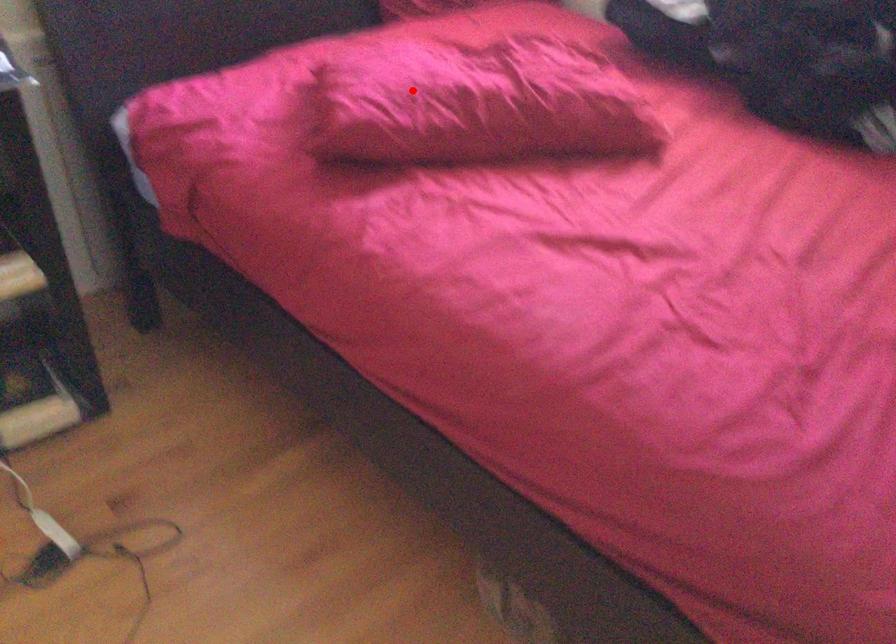
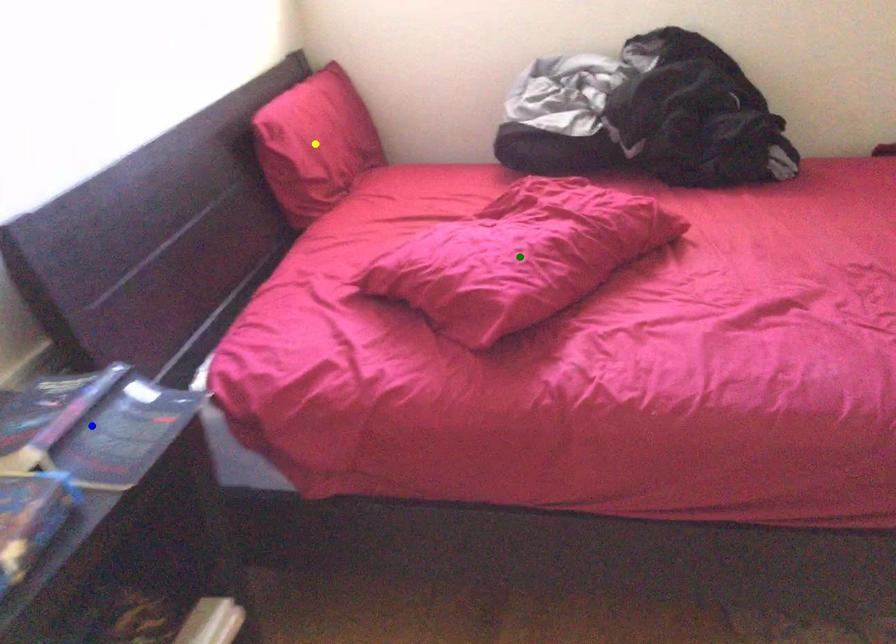
Question: I am providing you with two images of the same scene from different viewpoints. A red point is marked on the first image. You are given multiple points on the second image. Which mark in image 2 goes with the point in image 1?

Choices:
 (A) blue point
 (B) yellow point
 (C) green point

Answer: (C)